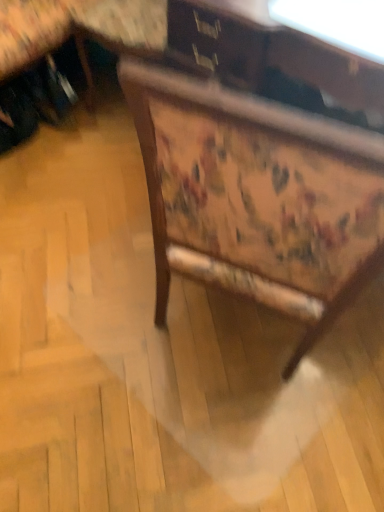
Locate an element on the screen. wooden floral-patterned dresser at center is located at coordinates (258, 166).

The width and height of the screenshot is (384, 512). Describe the element at coordinates (258, 166) in the screenshot. I see `wooden floral-patterned dresser at center` at that location.

The width and height of the screenshot is (384, 512). I want to click on wooden floral-patterned dresser at center, so click(x=258, y=166).